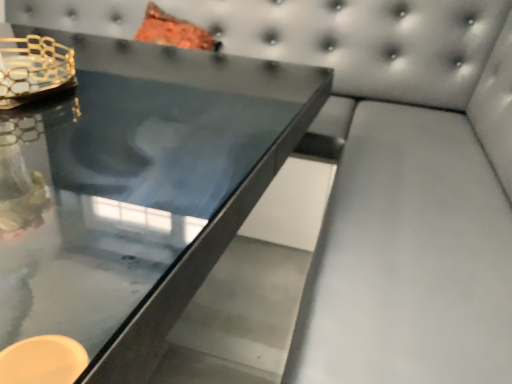
The image size is (512, 384). What do you see at coordinates (136, 190) in the screenshot?
I see `glossy glass table at center` at bounding box center [136, 190].

Measure the distance between glossy glass table at center and camera.

The distance of glossy glass table at center from camera is 13.03 inches.

Where is `glossy glass table at center`? Image resolution: width=512 pixels, height=384 pixels. glossy glass table at center is located at coordinates (136, 190).

The height and width of the screenshot is (384, 512). What do you see at coordinates (33, 68) in the screenshot? I see `gold mesh candle holder at upper left` at bounding box center [33, 68].

You are a GUI agent. You are given a task and a screenshot of the screen. Output one action in this format:
    pyautogui.click(x=<x>, y=<y>)
    Task: Click on the gold mesh candle holder at upper left
    
    Given the screenshot: What is the action you would take?
    [x=33, y=68]

In the scene shown: In order to face gold mesh candle holder at upper left, should I rotate leftwards or rightwards?

It's best to rotate left around 31.674 degrees.

Find the location of a particular element. glossy glass table at center is located at coordinates (136, 190).

Based on their positions, is glossy glass table at center located to the left or right of gold mesh candle holder at upper left?

From the image, it's evident that glossy glass table at center is to the right of gold mesh candle holder at upper left.

Which object is further away from the camera, glossy glass table at center or gold mesh candle holder at upper left?

gold mesh candle holder at upper left is further from the camera.

Which is closer to the camera, [161,356] or [73,80]?

The point [161,356] is closer.

From the image's perspective, is glossy glass table at center located above or below gold mesh candle holder at upper left?

Based on their image positions, glossy glass table at center is located beneath gold mesh candle holder at upper left.

From a real-world perspective, is glossy glass table at center positioned under gold mesh candle holder at upper left based on gravity?

Correct, in the physical world, glossy glass table at center is lower than gold mesh candle holder at upper left.

Between glossy glass table at center and gold mesh candle holder at upper left, which one has smaller width?

gold mesh candle holder at upper left is thinner.

Who is shorter, glossy glass table at center or gold mesh candle holder at upper left?

Standing shorter between the two is gold mesh candle holder at upper left.

Who is bigger, glossy glass table at center or gold mesh candle holder at upper left?

Bigger between the two is glossy glass table at center.

Is glossy glass table at center inside the boundaries of gold mesh candle holder at upper left, or outside?

glossy glass table at center cannot be found inside gold mesh candle holder at upper left.

Is glossy glass table at center not near gold mesh candle holder at upper left?

No, glossy glass table at center is not far away from gold mesh candle holder at upper left.

Based on the photo, is glossy glass table at center positioned with its back to gold mesh candle holder at upper left?

glossy glass table at center is not turned away from gold mesh candle holder at upper left.

Can you tell me how much glossy glass table at center and gold mesh candle holder at upper left differ in facing direction?

7.48 degrees separate the facing orientations of glossy glass table at center and gold mesh candle holder at upper left.

How much distance is there between glossy glass table at center and gold mesh candle holder at upper left?

glossy glass table at center and gold mesh candle holder at upper left are 28.97 centimeters apart.

This screenshot has height=384, width=512. Identify the location of table below the gold mesh candle holder at upper left (from a real-world perspective). (136, 190).

Which is more to the right, gold mesh candle holder at upper left or glossy glass table at center?

glossy glass table at center is more to the right.

Between gold mesh candle holder at upper left and glossy glass table at center, which one is positioned behind?

Positioned behind is gold mesh candle holder at upper left.

Is point (7, 61) closer to camera compared to point (65, 38)?

Yes, it is.

From the image's perspective, between gold mesh candle holder at upper left and glossy glass table at center, who is located below?

glossy glass table at center appears lower in the image.

From a real-world perspective, is gold mesh candle holder at upper left physically located above or below glossy glass table at center?

gold mesh candle holder at upper left is situated higher than glossy glass table at center in the real world.

Looking at their sizes, would you say gold mesh candle holder at upper left is wider or thinner than glossy glass table at center?

gold mesh candle holder at upper left is thinner than glossy glass table at center.

Does gold mesh candle holder at upper left have a greater height compared to glossy glass table at center?

In fact, gold mesh candle holder at upper left may be shorter than glossy glass table at center.

Between gold mesh candle holder at upper left and glossy glass table at center, which one has larger size?

Bigger between the two is glossy glass table at center.

Is gold mesh candle holder at upper left completely or partially outside of glossy glass table at center?

gold mesh candle holder at upper left is positioned outside glossy glass table at center.

Are gold mesh candle holder at upper left and glossy glass table at center beside each other?

No.

Looking at this image, could you tell me if gold mesh candle holder at upper left is facing glossy glass table at center?

No, gold mesh candle holder at upper left is not aimed at glossy glass table at center.

Identify the location of candle holder on the left of the glossy glass table at center. This screenshot has height=384, width=512. (33, 68).

In the image, there is a gold mesh candle holder at upper left. Where is `table below it (from a real-world perspective)`? table below it (from a real-world perspective) is located at coordinates (136, 190).

Where is `candle holder above the glossy glass table at center (from the image's perspective)`? candle holder above the glossy glass table at center (from the image's perspective) is located at coordinates (33, 68).